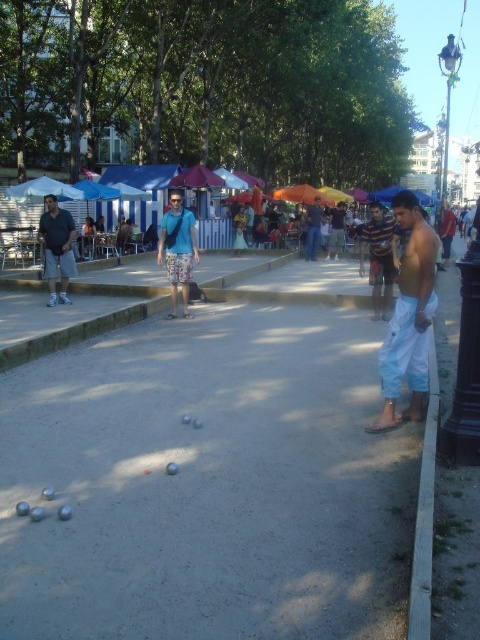
Which is in front, point (376, 305) or point (50, 285)?

Point (376, 305) is in front.

Where is `striped jersey at center`? Image resolution: width=480 pixels, height=640 pixels. striped jersey at center is located at coordinates (379, 259).

Is gray concrete pavement at center above striped jersey at center?

Actually, gray concrete pavement at center is below striped jersey at center.

Is gray concrete pavement at center behind striped jersey at center?

No, it is in front of striped jersey at center.

Which is behind, point (282, 337) or point (374, 304)?

Point (374, 304)

Find the location of a particular element. The width and height of the screenshot is (480, 640). gray concrete pavement at center is located at coordinates (210, 481).

Which is behind, point (383, 314) or point (446, 227)?

Positioned behind is point (446, 227).

Which is in front, point (380, 234) or point (450, 209)?

Point (380, 234) is in front.

Locate an element on the screen. This screenshot has width=480, height=640. striped jersey at center is located at coordinates (379, 259).